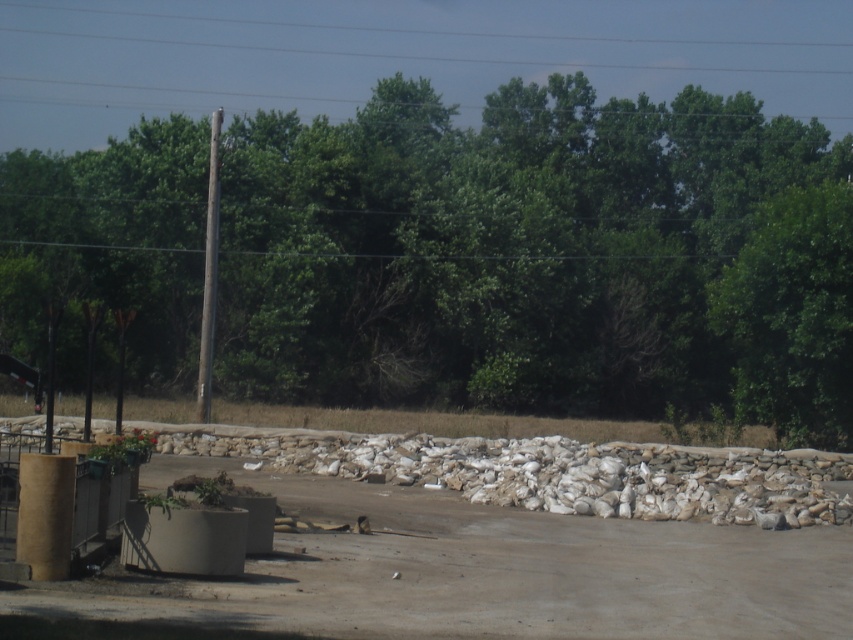
You are driving a car and need to turn left onto the dirt track at center. There is a green leafy tree at upper center in your way. Can you safely make the turn without hitting the tree?

The green leafy tree at upper center is positioned over the dirt track at center, so you cannot safely make the turn without hitting the tree.

You are a delivery person who needs to navigate between the green leafy tree at upper center and the brown wooden pole at left. Given that your delivery cart has a turning radius of 60 feet, will you be able to maneuver between these two objects?

The distance between the green leafy tree at upper center and the brown wooden pole at left is 57.02 feet. Since the turning radius of the delivery cart is 60 feet, which is larger than the distance between them, the cart will not be able to maneuver between these two objects without adjusting its path or position.

You are a painter who needs to set up an easel. You have a canvas that is 1.5 meters wide. You want to paint the green leafy tree at upper center and the brown wooden pole at left. Can you fit both subjects on your canvas if you position them side by side?

The green leafy tree at upper center might be wider than brown wooden pole at left. If the tree is wider than 1.5 meters, then the combined width of both subjects would exceed the canvas size. However, if the tree is narrower than 1.5 meters, they could fit. The exact width isn